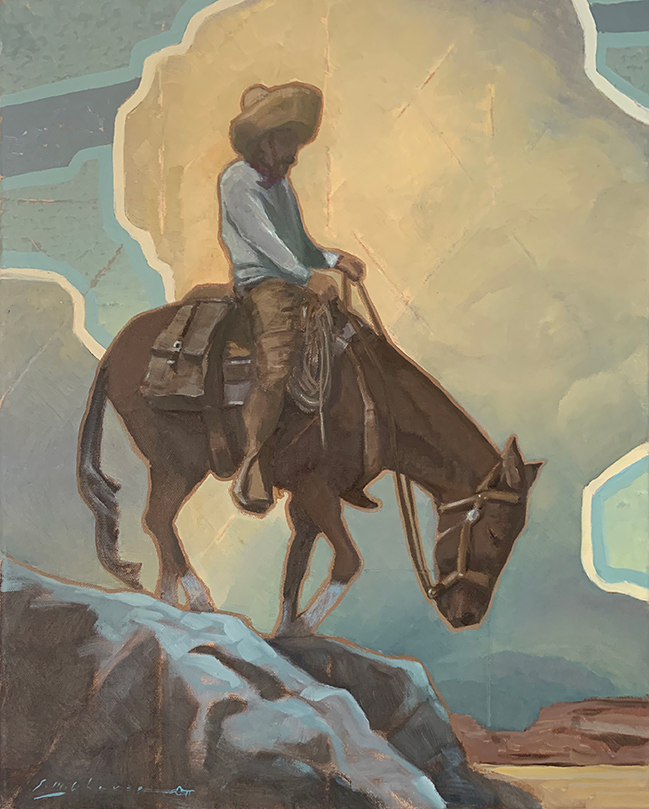
You are a GUI agent. You are given a task and a screenshot of the screen. Output one action in this format:
    pyautogui.click(x=<x>, y=<y>)
    Task: Click on the painting
    The width and height of the screenshot is (649, 809).
    Given the screenshot: What is the action you would take?
    pyautogui.click(x=518, y=646)